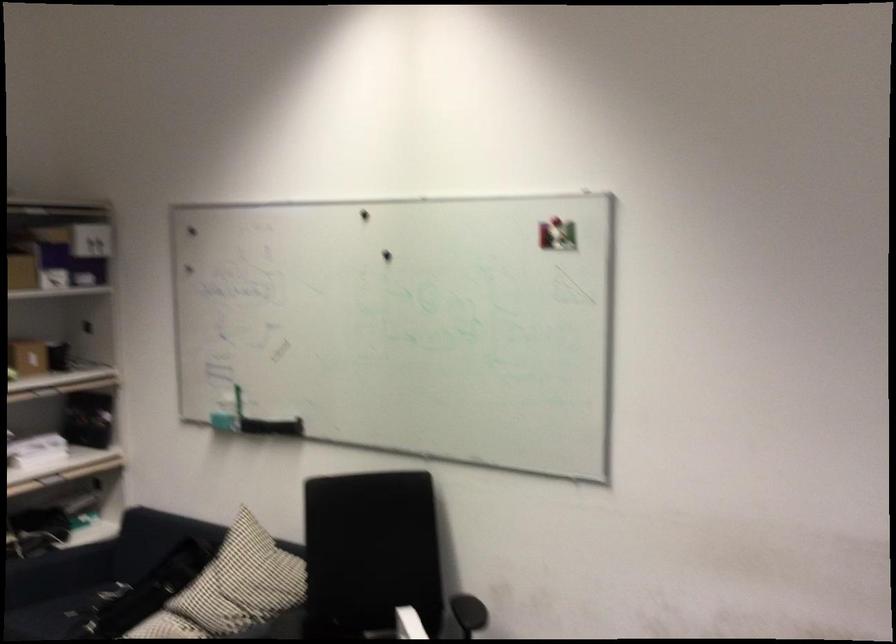
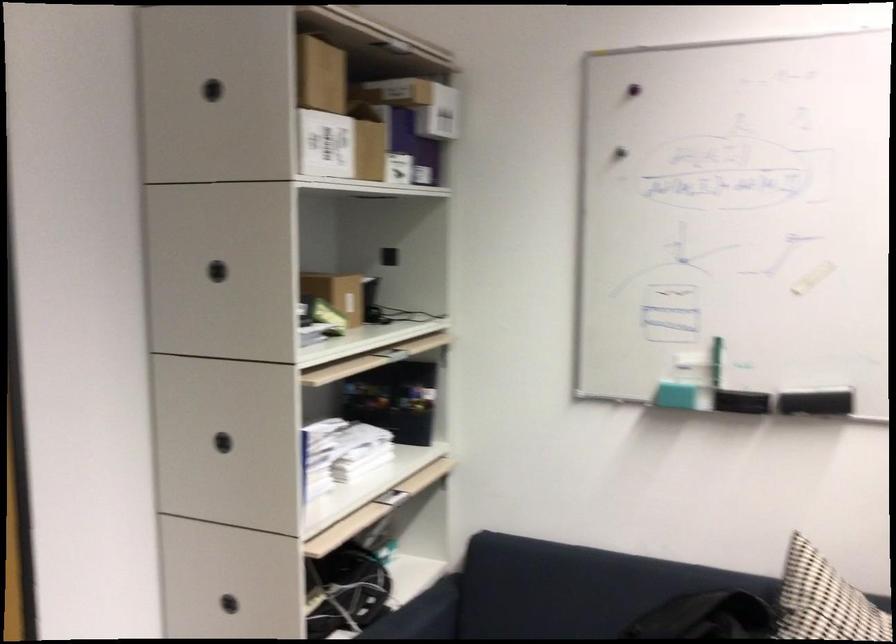
Where in the second image is the point corresponding to pixel 274 427 from the first image?

(815, 402)